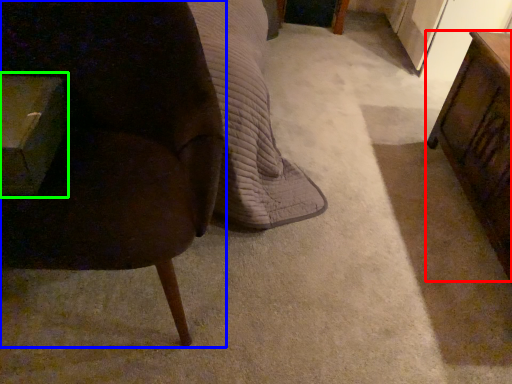
Question: Which object is positioned closest to table (highlighted by a red box)? Select from chair (highlighted by a blue box) and table (highlighted by a green box).

Choices:
 (A) chair
 (B) table

Answer: (A)